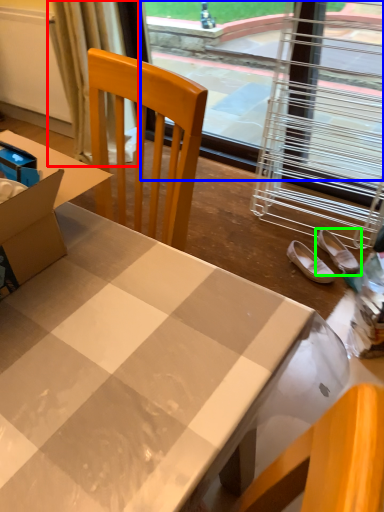
Question: Based on their relative distances, which object is nearer to curtain (highlighted by a red box)? Choose from window screen (highlighted by a blue box) and footwear (highlighted by a green box).

Choices:
 (A) window screen
 (B) footwear

Answer: (A)